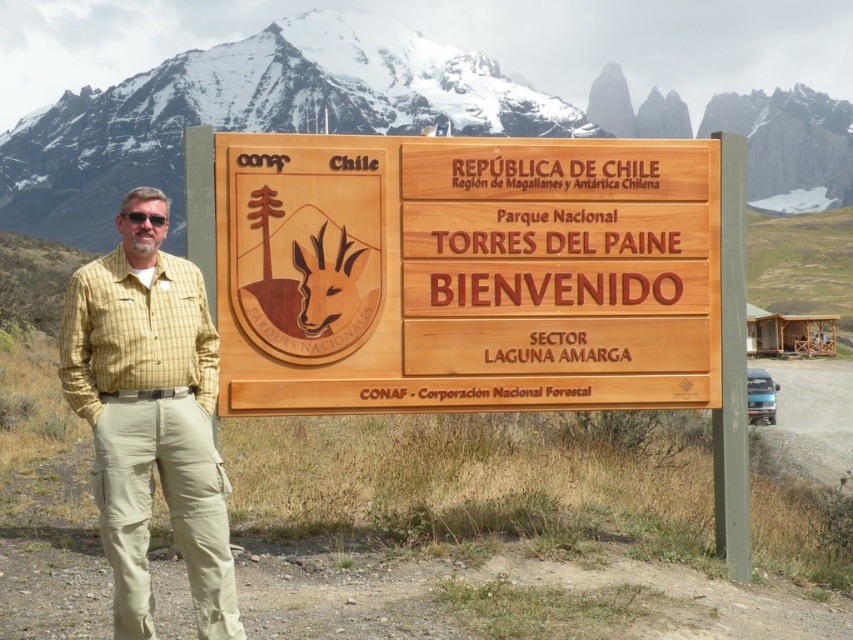
You are a hiker at the entrance of Parque Nacional Torres del Paine, Sector Laguna Amarga. You see two points marked on a map. The first point is at coordinates point (318, 97) and the second is at point (80, 385). Which point is closer to the signboard displayed at the entrance?

Point (80, 385) is closer to the signboard displayed at the entrance because it is in front of point (318, 97) according to the spatial relationship provided.

You are a hiker preparing to take a photo of the snowy white mountain at upper center and the yellow plaid shirt at left. If you want to include both in the frame, which object should you focus on to ensure both are visible?

You should focus on the snowy white mountain at upper center because it might be wider than the yellow plaid shirt at left, so centering on the mountain increases the likelihood of capturing both in the frame.

You are a hiker preparing to take a photo of the wooden sign at center and the yellow plaid shirt at left. If you want to include both objects in your photo frame, which object should you position closer to the center of the frame to ensure both fit properly?

The wooden sign at center is wider than the yellow plaid shirt at left. To include both in the photo frame, position the wooden sign at center closer to the center of the frame so that its larger width can be accommodated while still fitting the yellow plaid shirt at left within the frame.